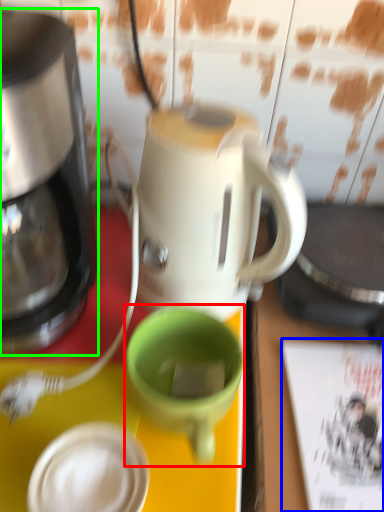
Question: Estimate the real-world distances between objects in this image. Which object is farther from coffee cup (highlighted by a red box), magazine (highlighted by a blue box) or coffee maker (highlighted by a green box)?

Choices:
 (A) magazine
 (B) coffee maker

Answer: (B)